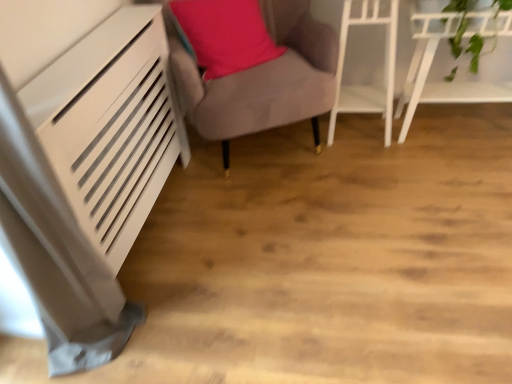
Locate an element on the screen. This screenshot has width=512, height=384. vacant space underneath velvet grey armchair at center, which is counted as the first furniture, starting from the left (from a real-world perspective) is located at coordinates (266, 148).